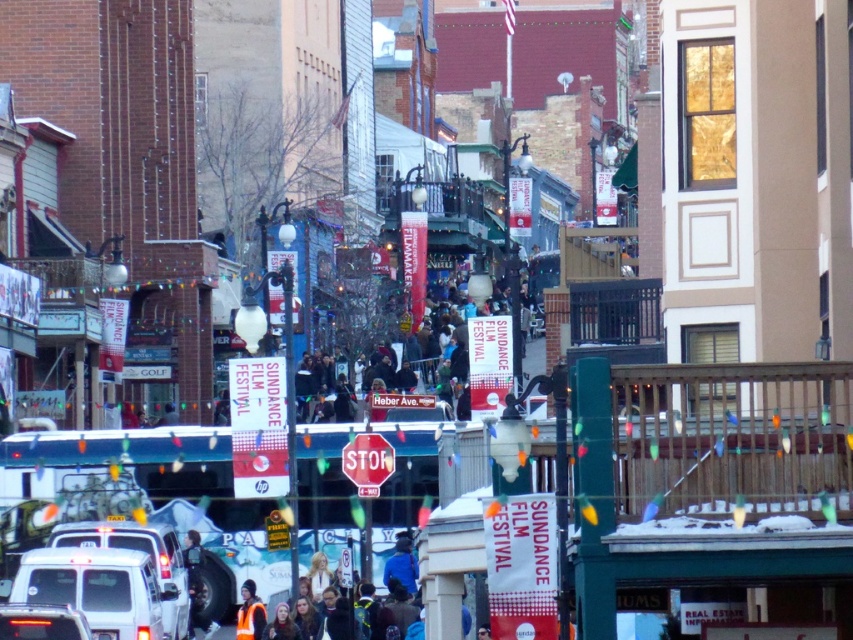
Question: Which point is closer to the camera?

Choices:
 (A) (39, 589)
 (B) (3, 612)
 (C) (375, 480)
 (D) (251, 625)

Answer: (B)

Question: Observing the image, what is the correct spatial positioning of metallic reflective stop sign at center in reference to reflective yellow vest at lower center?

Choices:
 (A) below
 (B) above

Answer: (B)

Question: Which object appears farthest from the camera in this image?

Choices:
 (A) metallic reflective stop sign at center
 (B) matte white van at lower left
 (C) white matte van at lower left

Answer: (C)

Question: Which point appears farthest from the camera in this image?

Choices:
 (A) [x=373, y=449]
 (B) [x=247, y=602]

Answer: (B)

Question: Considering the relative positions of matte white van at lower left and reflective yellow vest at lower center in the image provided, where is matte white van at lower left located with respect to reflective yellow vest at lower center?

Choices:
 (A) below
 (B) above

Answer: (B)

Question: Can you confirm if white matte van at lower left is positioned below metallic reflective stop sign at center?

Choices:
 (A) no
 (B) yes

Answer: (B)